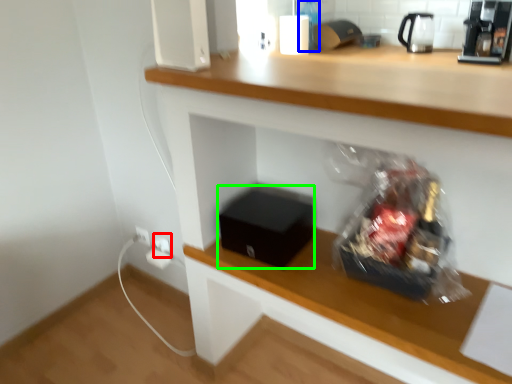
Question: Estimate the real-world distances between objects in this image. Which object is farther from electric outlet (highlighted by a red box), bottle (highlighted by a blue box) or box (highlighted by a green box)?

Choices:
 (A) bottle
 (B) box

Answer: (A)